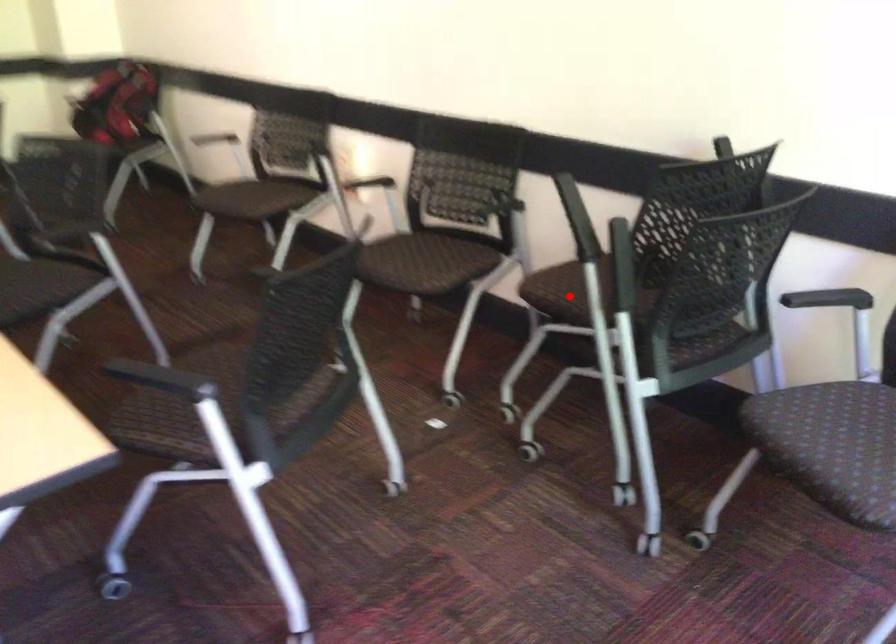
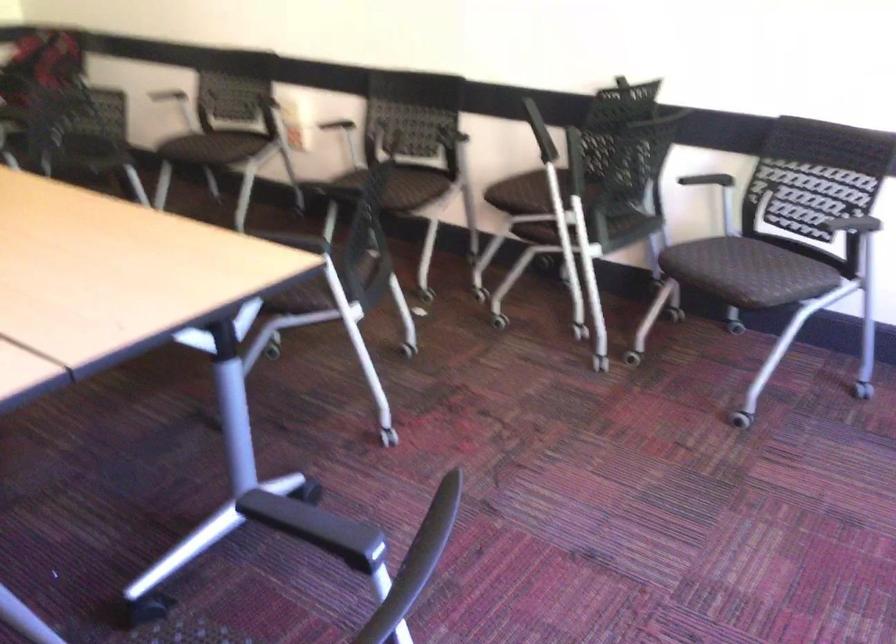
Question: I am providing you with two images of the same scene from different viewpoints. A red point is marked on the first image. At the location where the point appears in image 1, is it still visible in image 2?

Choices:
 (A) Yes
 (B) No

Answer: (A)